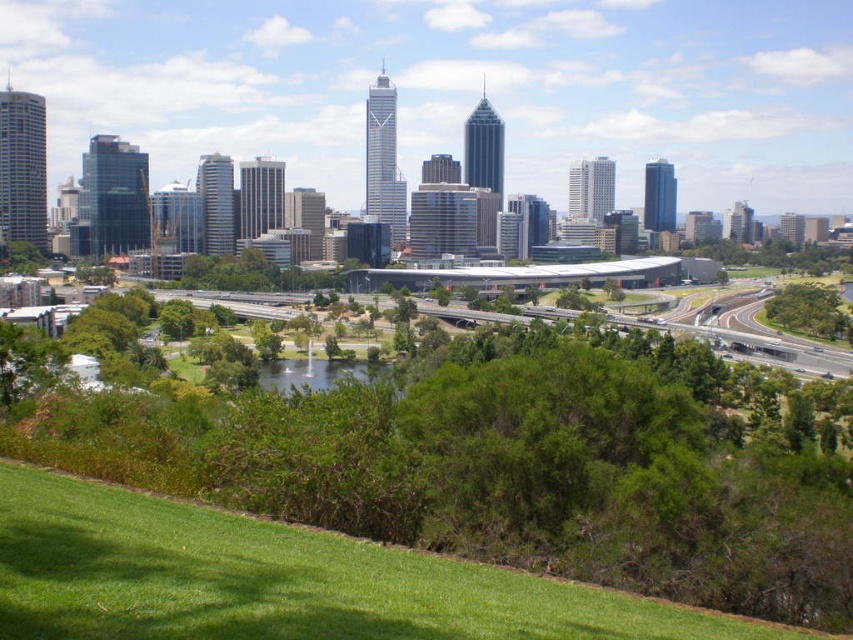
Question: Does green grassy park at center appear under green asphalt highway at center?

Choices:
 (A) no
 (B) yes

Answer: (B)

Question: Does green grassy park at center appear on the right side of green asphalt highway at center?

Choices:
 (A) no
 (B) yes

Answer: (A)

Question: Can you confirm if green grassy park at center is positioned below green asphalt highway at center?

Choices:
 (A) no
 (B) yes

Answer: (B)